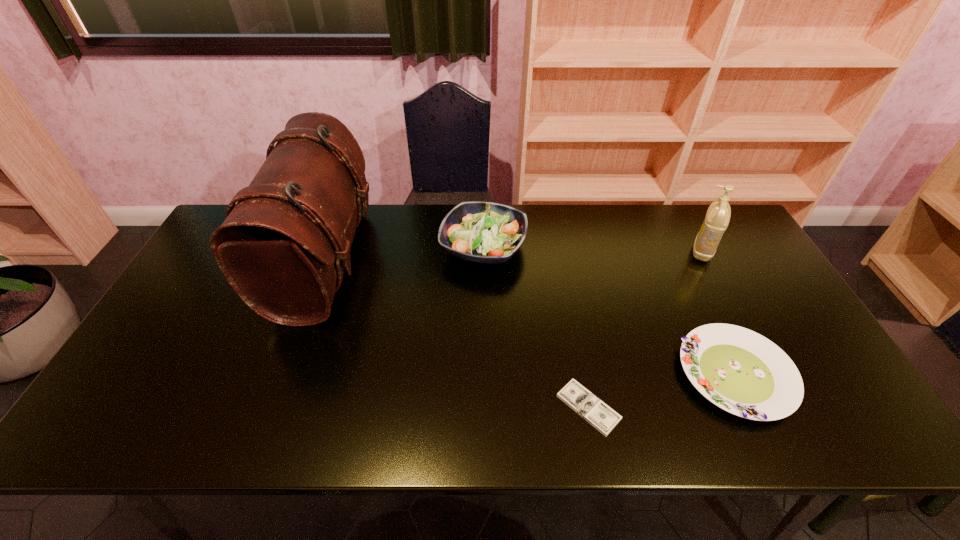
Where is `salad plate that is at the right edge`? This screenshot has width=960, height=540. salad plate that is at the right edge is located at coordinates (742, 372).

Where is `object that is at the far right corner`? The width and height of the screenshot is (960, 540). object that is at the far right corner is located at coordinates coord(718,215).

Where is `object that is at the near right corner`? This screenshot has width=960, height=540. object that is at the near right corner is located at coordinates (742, 372).

Where is `vacant space at the far edge`? Image resolution: width=960 pixels, height=540 pixels. vacant space at the far edge is located at coordinates (657, 225).

This screenshot has height=540, width=960. In the image, there is a desktop. Find the location of `free space at the near edge`. free space at the near edge is located at coordinates (397, 428).

At what (x,y) coordinates should I click in order to perform the action: click on free space at the right edge. Please return your answer as a coordinate pair (x, y). Looking at the image, I should click on (750, 303).

Image resolution: width=960 pixels, height=540 pixels. Identify the location of blank region between the shorter salad plate and the leftmost object. (530, 318).

Locate an element on the screen. Image resolution: width=960 pixels, height=540 pixels. empty space between the fourth shortest object and the fourth tallest object is located at coordinates (719, 313).

Find the location of a particular element. The height and width of the screenshot is (540, 960). empty space between the left salad plate and the shortest object is located at coordinates (536, 327).

At what (x,y) coordinates should I click in order to perform the action: click on free space that is in between the fourth tallest object and the leftmost object. Please return your answer as a coordinate pair (x, y). Looking at the image, I should click on (530, 318).